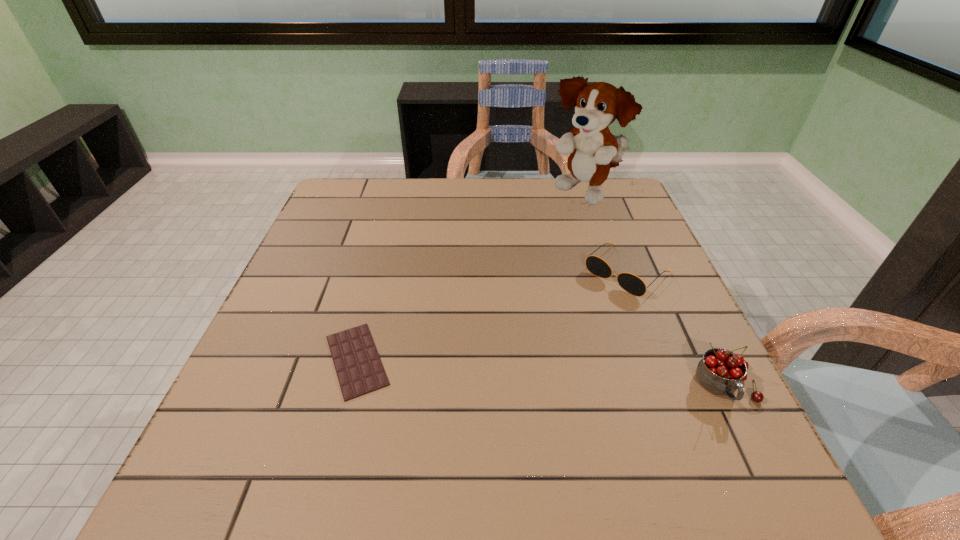
Locate an element on the screen. vacant spot on the desktop that is between the chocolate bar and the pot filled with cherries and is positioned on the face of the puppy is located at coordinates (492, 370).

This screenshot has width=960, height=540. Identify the location of free space on the desktop that is between the shortest object and the third shortest object and is positioned on the front-facing side of the sunglasses. (516, 372).